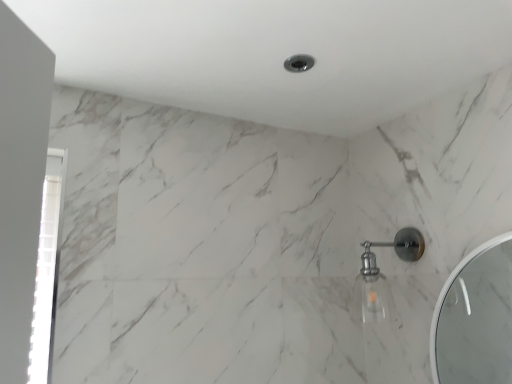
Describe the element at coordinates (47, 268) in the screenshot. The width and height of the screenshot is (512, 384). I see `transparent glass door at left` at that location.

Where is `transparent glass door at left`? This screenshot has height=384, width=512. transparent glass door at left is located at coordinates (47, 268).

Find the location of a particular element. The image size is (512, 384). transparent glass door at left is located at coordinates click(x=47, y=268).